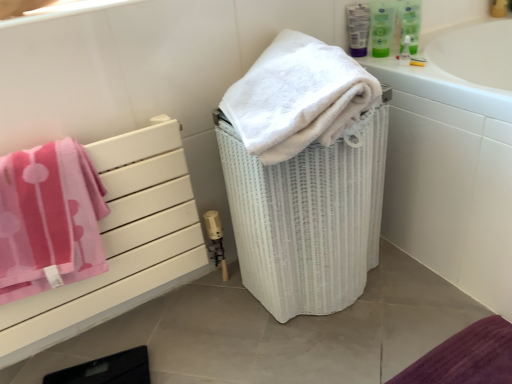
Where is `free space to the right of white wicker laundry basket at center`? free space to the right of white wicker laundry basket at center is located at coordinates (428, 291).